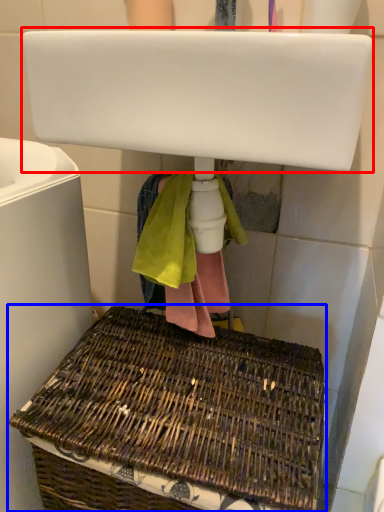
Question: Among these objects, which one is nearest to the camera, sink (highlighted by a red box) or picnic basket (highlighted by a blue box)?

Choices:
 (A) sink
 (B) picnic basket

Answer: (A)